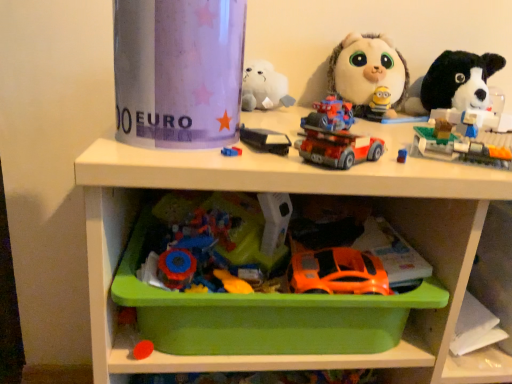
Question: Considering the relative positions of orange matte car at lower center, the 1th toy from the bottom, and translucent plastic building blocks at upper right, the third toy when ordered from bottom to top, in the image provided, is orange matte car at lower center, the 1th toy from the bottom, behind translucent plastic building blocks at upper right, the third toy when ordered from bottom to top,?

Choices:
 (A) yes
 (B) no

Answer: (A)

Question: Are orange matte car at lower center, the 5th toy positioned from the top, and translucent plastic building blocks at upper right, which is the third toy from top to bottom, located far from each other?

Choices:
 (A) yes
 (B) no

Answer: (B)

Question: Is orange matte car at lower center, the 1th toy from the bottom, smaller than translucent plastic building blocks at upper right, which is the third toy from top to bottom?

Choices:
 (A) yes
 (B) no

Answer: (A)

Question: Does orange matte car at lower center, the 5th toy positioned from the top, appear on the right side of translucent plastic building blocks at upper right, the third toy when ordered from bottom to top?

Choices:
 (A) no
 (B) yes

Answer: (A)

Question: Is orange matte car at lower center, the 5th toy positioned from the top, bigger than translucent plastic building blocks at upper right, which is the third toy from top to bottom?

Choices:
 (A) yes
 (B) no

Answer: (B)

Question: Is green plastic tray at lower center inside or outside of black plush dog at upper right, which is counted as the 4th toy, starting from the bottom?

Choices:
 (A) inside
 (B) outside

Answer: (B)

Question: From a real-world perspective, is green plastic tray at lower center positioned above or below black plush dog at upper right, the 2th toy from the top?

Choices:
 (A) below
 (B) above

Answer: (A)

Question: From the image's perspective, is green plastic tray at lower center located above or below black plush dog at upper right, the 2th toy from the top?

Choices:
 (A) above
 (B) below

Answer: (B)

Question: Considering the positions of green plastic tray at lower center and black plush dog at upper right, the 2th toy from the top, in the image, is green plastic tray at lower center bigger or smaller than black plush dog at upper right, the 2th toy from the top,?

Choices:
 (A) small
 (B) big

Answer: (B)

Question: Would you say fluffy white plush toy at upper right, positioned as the 1th toy in top-to-bottom order, is to the left or to the right of green plastic tray at lower center in the picture?

Choices:
 (A) left
 (B) right

Answer: (B)

Question: Is fluffy white plush toy at upper right, the 5th toy positioned from the bottom, wider or thinner than green plastic tray at lower center?

Choices:
 (A) thin
 (B) wide

Answer: (A)

Question: Relative to green plastic tray at lower center, is fluffy white plush toy at upper right, positioned as the 1th toy in top-to-bottom order, in front or behind?

Choices:
 (A) front
 (B) behind

Answer: (B)

Question: Is point (395, 102) positioned closer to the camera than point (175, 344)?

Choices:
 (A) closer
 (B) farther

Answer: (B)

Question: Choose the correct answer: Is translucent plastic building blocks at upper right, the third toy when ordered from bottom to top, inside fluffy white plush toy at upper right, the 5th toy positioned from the bottom, or outside it?

Choices:
 (A) inside
 (B) outside

Answer: (B)

Question: From a real-world perspective, relative to fluffy white plush toy at upper right, the 5th toy positioned from the bottom, is translucent plastic building blocks at upper right, which is the third toy from top to bottom, vertically above or below?

Choices:
 (A) below
 (B) above

Answer: (A)